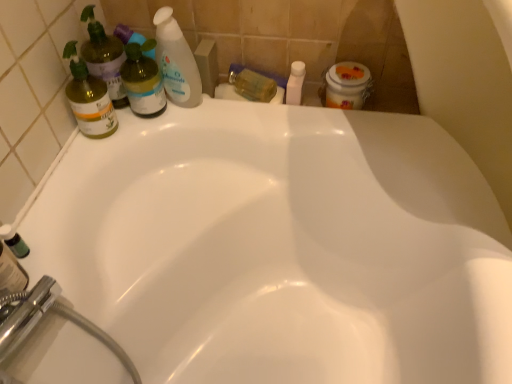
Question: Is translucent yellow bottle at upper center, the second toiletry from the right, to the left or to the right of translucent plastic bottle at upper left, the 1th cleaning product positioned from the right, in the image?

Choices:
 (A) right
 (B) left

Answer: (A)

Question: Is point (258, 77) positioned closer to the camera than point (177, 41)?

Choices:
 (A) closer
 (B) farther

Answer: (B)

Question: Based on their relative distances, which object is farther from the white plastic bottle at upper center, acting as the 1th toiletry starting from the right?

Choices:
 (A) green matte bottle at lower left
 (B) translucent yellow bottle at upper center, the second toiletry from the right
 (C) matte green bottle at left, which is counted as the 2th cleaning product, starting from the right
 (D) green glass spray bottle at left, the 3th cleaning product from the right
 (E) translucent plastic bottle at upper left, the 1th cleaning product positioned from the right

Answer: (A)

Question: Considering the real-world distances, which object is closest to the translucent plastic bottle at upper left, the 1th cleaning product positioned from the right?

Choices:
 (A) translucent yellow bottle at upper center, the second toiletry from the right
 (B) green matte bottle at lower left
 (C) white plastic bottle at upper center, acting as the 1th toiletry starting from the right
 (D) matte green bottle at left, the 2th cleaning product from the left
 (E) green glass spray bottle at left, the 3th cleaning product from the right

Answer: (D)